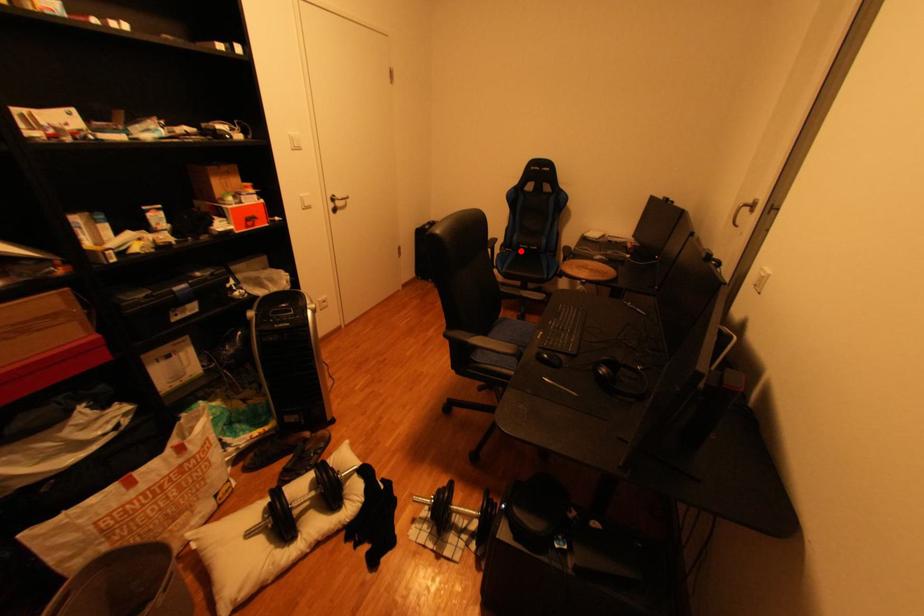
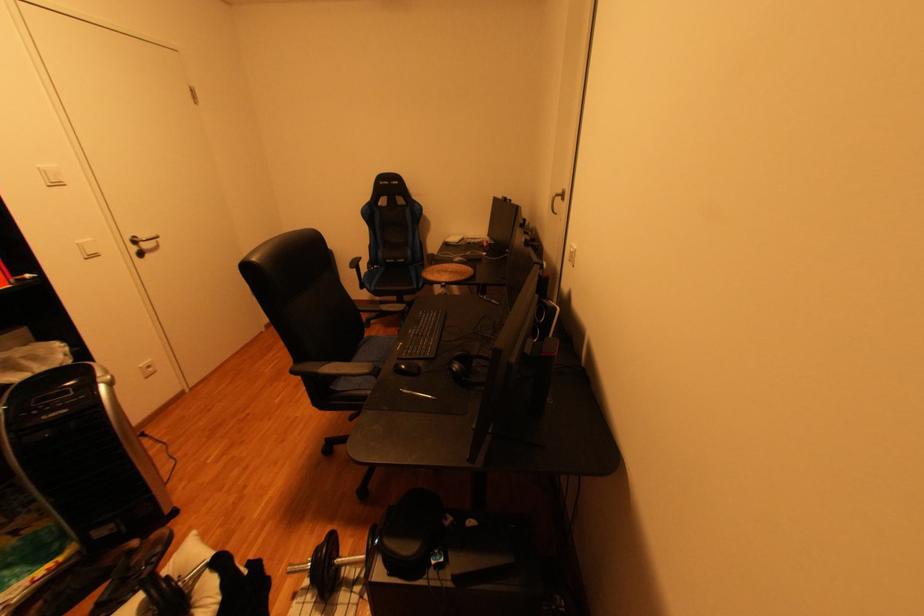
The point at the highlighted location is marked in the first image. Where is the corresponding point in the second image?

(390, 267)